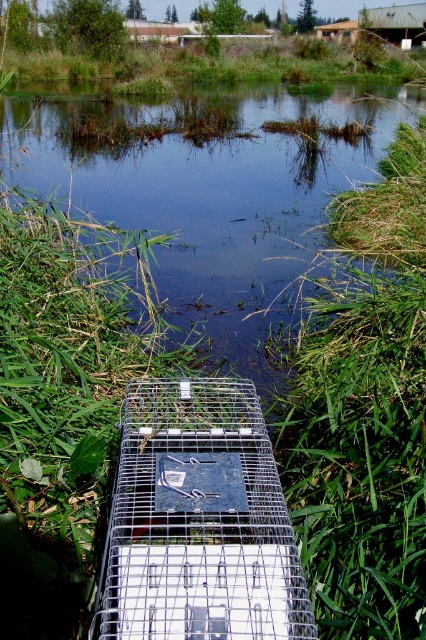
Question: Which point is farther to the camera?

Choices:
 (A) (166, 148)
 (B) (279, 611)
 (C) (255, 72)

Answer: (C)

Question: Where is green grassy pond at center located in relation to green grass at upper center in the image?

Choices:
 (A) above
 (B) below

Answer: (B)

Question: Estimate the real-world distances between objects in this image. Which object is closer to the silver metallic birdcage at center?

Choices:
 (A) green grass at upper center
 (B) green grassy pond at center

Answer: (B)

Question: Is silver metallic birdcage at center wider than green grass at upper center?

Choices:
 (A) no
 (B) yes

Answer: (A)

Question: Can you confirm if silver metallic birdcage at center is wider than green grass at upper center?

Choices:
 (A) yes
 (B) no

Answer: (B)

Question: Among these points, which one is farthest from the camera?

Choices:
 (A) tap(170, 60)
 (B) tap(219, 400)

Answer: (A)